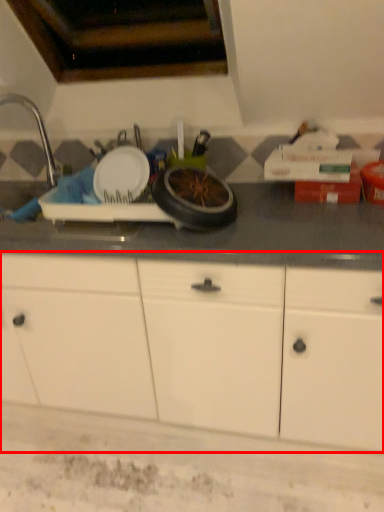
Question: In this image, where is cabinetry (annotated by the red box) located relative to faucet?

Choices:
 (A) right
 (B) left

Answer: (A)